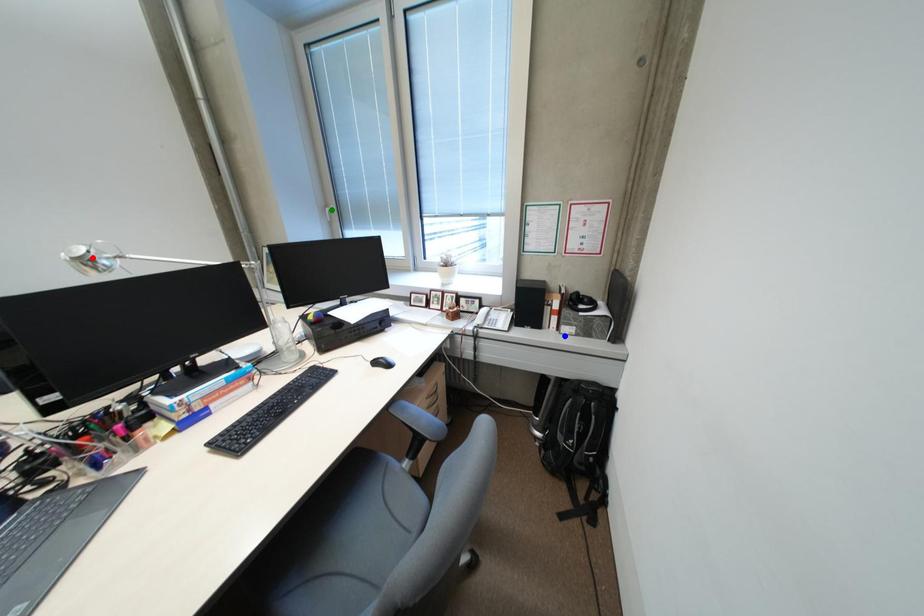
Order these from nearest to farthest:
A) green point
B) blue point
C) red point

green point
blue point
red point